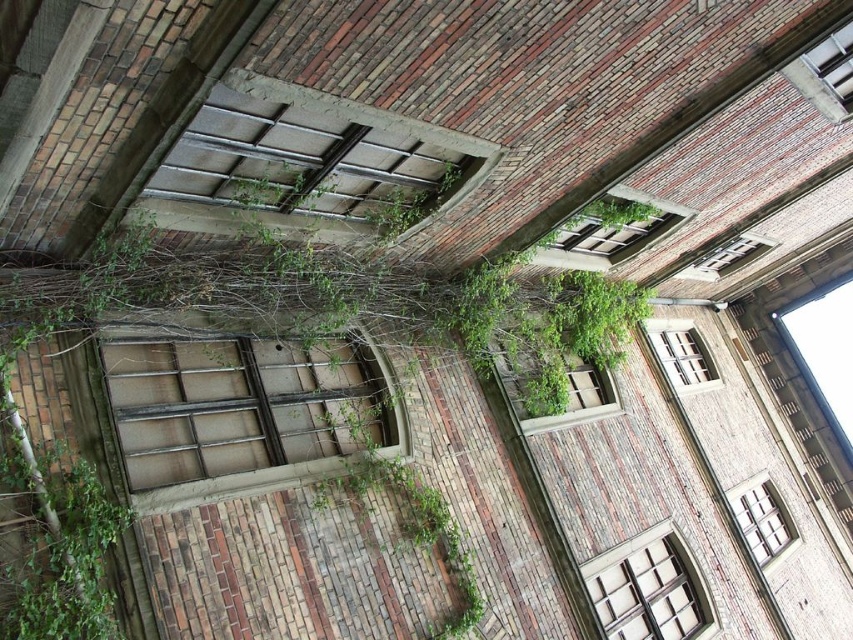
Question: Which of the following is the closest to the observer?

Choices:
 (A) wooden-framed window at center
 (B) wooden window frame at center
 (C) green mossy window at upper center
 (D) green leafy plant at center

Answer: (D)

Question: Does green mossy window at upper center have a smaller size compared to clear glass window at upper right?

Choices:
 (A) no
 (B) yes

Answer: (A)

Question: In this image, where is wooden-framed window at center located relative to matte glass window at center?

Choices:
 (A) above
 (B) below

Answer: (B)

Question: Which object is positioned closest to the matte glass window at center?

Choices:
 (A) wooden-framed window at center
 (B) wooden lattice window at center
 (C) green leafy plant at center

Answer: (C)

Question: Which point appears closest to the camera in this image?

Choices:
 (A) (778, 497)
 (B) (704, 381)
 (C) (277, 266)

Answer: (C)

Question: Does wooden window frame at center appear on the right side of clear glass window at center?

Choices:
 (A) no
 (B) yes

Answer: (A)